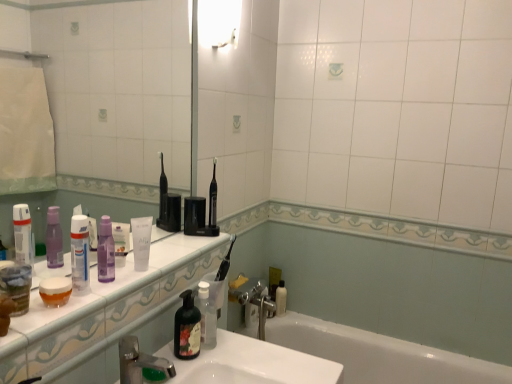
I want to click on empty space that is to the right of purple matte bottle at center, so click(x=136, y=279).